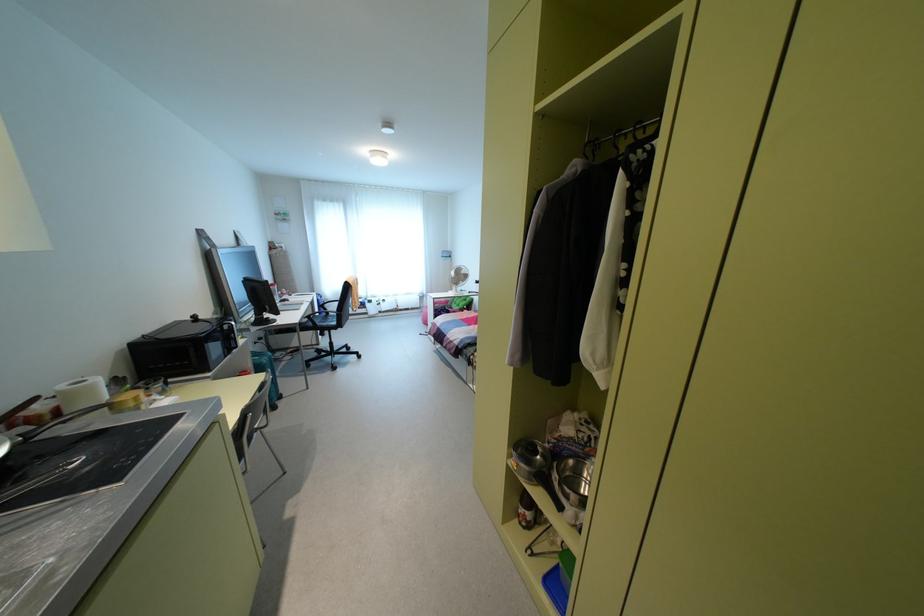
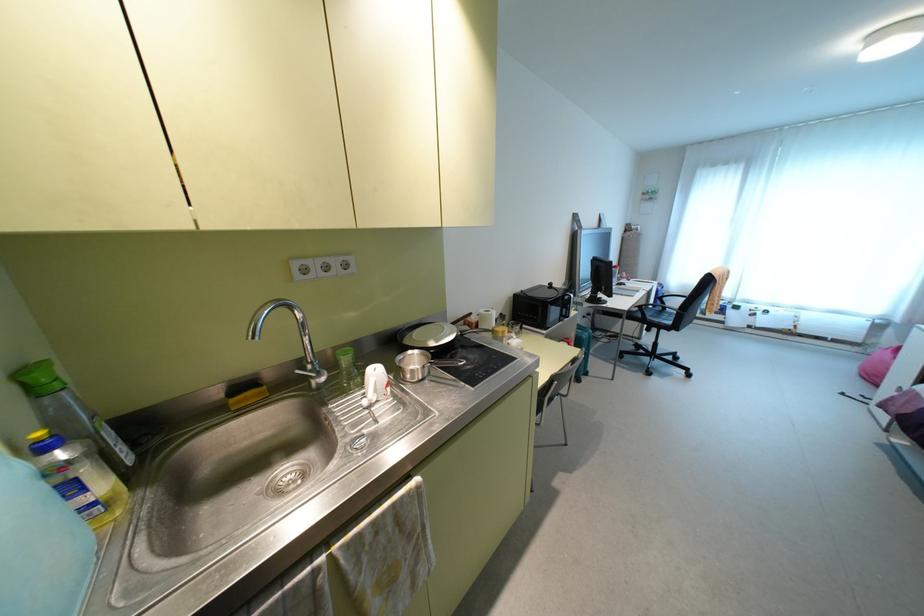
In the second image, find the point that corresponds to [332,306] in the first image.

(674, 302)